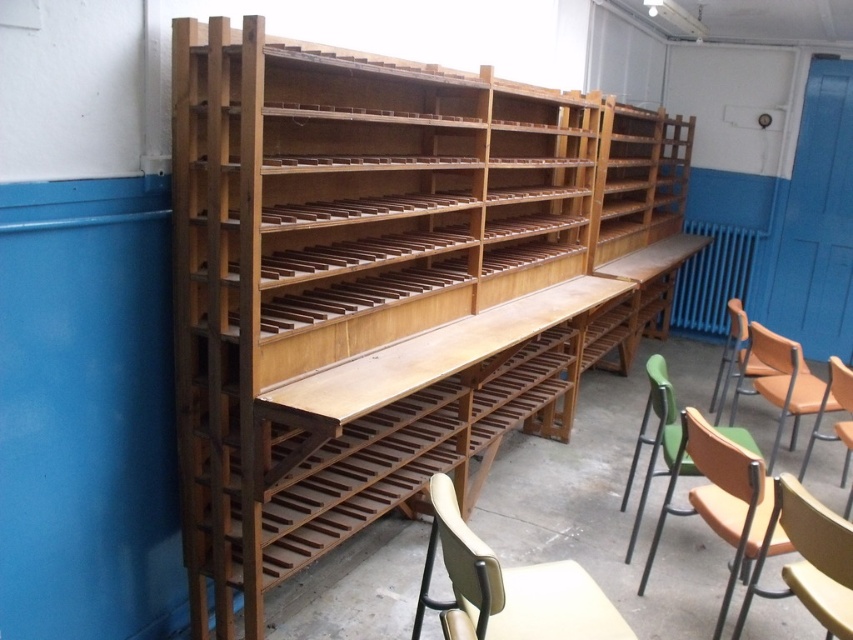
Looking at this image, you are standing in front of the shelving unit and want to sit down. The matte orange chair at right is your only option. Based on its position, can you estimate how far to your right you should walk to reach it?

The matte orange chair at right is located at coordinates point (785, 381), so you should walk approximately 0.597 meters to your right to reach it.

You are standing in the room and want to locate the natural wood bookshelf at center. According to the coordinates provided, where should you look?

The natural wood bookshelf at center is located at coordinates point (x=384, y=282).